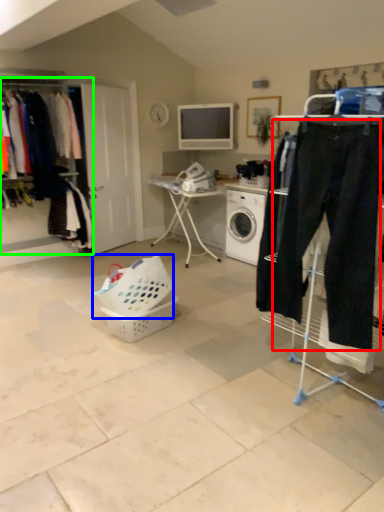
Question: Which object is positioned closest to sweat pant (highlighted by a red box)? Select from basket (highlighted by a blue box) and closet (highlighted by a green box).

Choices:
 (A) basket
 (B) closet

Answer: (A)